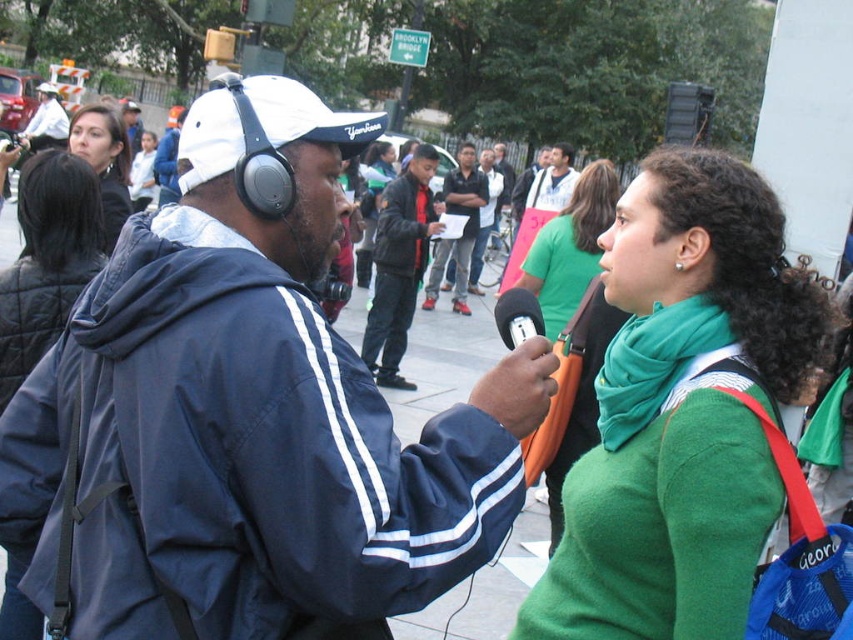
You are a photographer standing at the edge of the scene. You want to take a picture of the dark blue jacket at center without including the signpost in the background. Is the jacket positioned in a way that allows this?

The dark blue jacket at center is located at point (399, 264), so yes, it can be framed to exclude the signpost by adjusting the camera angle or zoom.

You are a photographer trying to capture a candid shot of the green jersey at center and the matte black headphones at upper left. Which object should you zoom in on to ensure both are in focus without moving your camera position?

The green jersey at center is smaller than the matte black headphones at upper left, so you should zoom in on the larger matte black headphones at upper left to ensure both objects are in focus while maintaining proper framing.